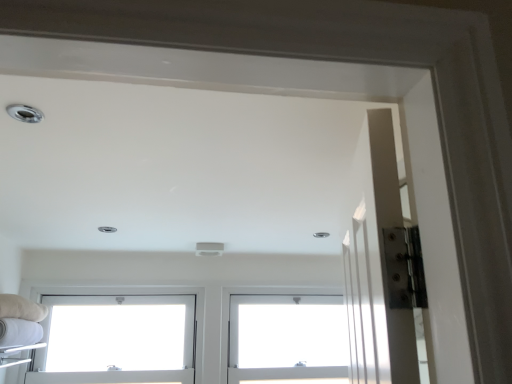
Find the location of a particular element. This screenshot has width=512, height=384. white plastic window at lower left, the 1th window from the left is located at coordinates (117, 340).

How much space does white plastic window at lower left, which appears as the second window when viewed from the right, occupy horizontally?

6.81 inches.

The image size is (512, 384). What do you see at coordinates (117, 340) in the screenshot?
I see `white plastic window at lower left, the 1th window from the left` at bounding box center [117, 340].

Measure the distance between white plastic window at center, which appears as the second window when viewed from the left, and camera.

white plastic window at center, which appears as the second window when viewed from the left, and camera are 6.82 feet apart from each other.

The width and height of the screenshot is (512, 384). Describe the element at coordinates (286, 338) in the screenshot. I see `white plastic window at center, which appears as the second window when viewed from the left` at that location.

Identify the location of white plastic window at center, the first window viewed from the right. Image resolution: width=512 pixels, height=384 pixels. (286, 338).

Locate an element on the screen. white plastic window at lower left, the 1th window from the left is located at coordinates (117, 340).

Between white plastic window at center, which appears as the second window when viewed from the left, and white plastic window at lower left, which appears as the second window when viewed from the right, which one appears on the right side from the viewer's perspective?

white plastic window at center, which appears as the second window when viewed from the left, is more to the right.

Is white plastic window at center, which appears as the second window when viewed from the left, in front of or behind white plastic window at lower left, the 1th window from the left, in the image?

Visually, white plastic window at center, which appears as the second window when viewed from the left, is located behind white plastic window at lower left, the 1th window from the left.

Between point (297, 311) and point (97, 334), which one is positioned behind?

Point (297, 311)

From the image's perspective, is white plastic window at center, the first window viewed from the right, above or below white plastic window at lower left, which appears as the second window when viewed from the right?

white plastic window at center, the first window viewed from the right, is situated lower than white plastic window at lower left, which appears as the second window when viewed from the right, in the image.

From a real-world perspective, relative to white plastic window at lower left, the 1th window from the left, is white plastic window at center, which appears as the second window when viewed from the left, vertically above or below?

From a real-world perspective, white plastic window at center, which appears as the second window when viewed from the left, is physically below white plastic window at lower left, the 1th window from the left.

Between white plastic window at center, which appears as the second window when viewed from the left, and white plastic window at lower left, the 1th window from the left, which one has larger width?

white plastic window at center, which appears as the second window when viewed from the left, is wider.

Considering the sizes of objects white plastic window at center, which appears as the second window when viewed from the left, and white plastic window at lower left, which appears as the second window when viewed from the right, in the image provided, who is taller, white plastic window at center, which appears as the second window when viewed from the left, or white plastic window at lower left, which appears as the second window when viewed from the right,?

With more height is white plastic window at center, which appears as the second window when viewed from the left.

In the scene shown: Considering the sizes of white plastic window at center, which appears as the second window when viewed from the left, and white plastic window at lower left, which appears as the second window when viewed from the right, in the image, is white plastic window at center, which appears as the second window when viewed from the left, bigger or smaller than white plastic window at lower left, which appears as the second window when viewed from the right,?

white plastic window at center, which appears as the second window when viewed from the left, is smaller than white plastic window at lower left, which appears as the second window when viewed from the right.

Do you think white plastic window at center, which appears as the second window when viewed from the left, is within white plastic window at lower left, which appears as the second window when viewed from the right, or outside of it?

white plastic window at center, which appears as the second window when viewed from the left, is outside white plastic window at lower left, which appears as the second window when viewed from the right.

Is white plastic window at center, which appears as the second window when viewed from the left, oriented towards white plastic window at lower left, which appears as the second window when viewed from the right?

No, white plastic window at center, which appears as the second window when viewed from the left, is not aimed at white plastic window at lower left, which appears as the second window when viewed from the right.

How many degrees apart are the facing directions of white plastic window at center, which appears as the second window when viewed from the left, and white plastic window at lower left, which appears as the second window when viewed from the right?

The facing directions of white plastic window at center, which appears as the second window when viewed from the left, and white plastic window at lower left, which appears as the second window when viewed from the right, are 0.000391 degrees apart.

Measure the distance between white plastic window at center, which appears as the second window when viewed from the left, and white plastic window at lower left, which appears as the second window when viewed from the right.

white plastic window at center, which appears as the second window when viewed from the left, and white plastic window at lower left, which appears as the second window when viewed from the right, are 23.92 inches apart from each other.

The height and width of the screenshot is (384, 512). I want to click on window located in front of the white plastic window at center, the first window viewed from the right, so click(117, 340).

Consider the image. Which object is positioned more to the right, white plastic window at lower left, which appears as the second window when viewed from the right, or white plastic window at center, the first window viewed from the right?

white plastic window at center, the first window viewed from the right, is more to the right.

Is white plastic window at lower left, which appears as the second window when viewed from the right, positioned in front of white plastic window at center, the first window viewed from the right?

Yes, the depth of white plastic window at lower left, which appears as the second window when viewed from the right, is less than that of white plastic window at center, the first window viewed from the right.

Is point (34, 369) closer to viewer compared to point (324, 370)?

Yes, it is in front of point (324, 370).

From the image's perspective, is white plastic window at lower left, the 1th window from the left, on white plastic window at center, which appears as the second window when viewed from the left?

Indeed, from the image's perspective, white plastic window at lower left, the 1th window from the left, is shown above white plastic window at center, which appears as the second window when viewed from the left.

Looking at this image, from a real-world perspective, does white plastic window at lower left, the 1th window from the left, stand above white plastic window at center, the first window viewed from the right?

Correct, in the physical world, white plastic window at lower left, the 1th window from the left, is higher than white plastic window at center, the first window viewed from the right.

Is white plastic window at lower left, which appears as the second window when viewed from the right, thinner than white plastic window at center, which appears as the second window when viewed from the left?

Correct, the width of white plastic window at lower left, which appears as the second window when viewed from the right, is less than that of white plastic window at center, which appears as the second window when viewed from the left.

From their relative heights in the image, would you say white plastic window at lower left, the 1th window from the left, is taller or shorter than white plastic window at center, the first window viewed from the right?

Clearly, white plastic window at lower left, the 1th window from the left, is shorter compared to white plastic window at center, the first window viewed from the right.

Can you confirm if white plastic window at lower left, the 1th window from the left, is smaller than white plastic window at center, which appears as the second window when viewed from the left?

No, white plastic window at lower left, the 1th window from the left, is not smaller than white plastic window at center, which appears as the second window when viewed from the left.

Is white plastic window at center, the first window viewed from the right, inside white plastic window at lower left, which appears as the second window when viewed from the right?

No, white plastic window at center, the first window viewed from the right, is not surrounded by white plastic window at lower left, which appears as the second window when viewed from the right.

Based on the photo, is white plastic window at lower left, the 1th window from the left, with white plastic window at center, which appears as the second window when viewed from the left?

No, white plastic window at lower left, the 1th window from the left, is not next to white plastic window at center, which appears as the second window when viewed from the left.

Is white plastic window at center, which appears as the second window when viewed from the left, at the back of white plastic window at lower left, the 1th window from the left?

No, white plastic window at center, which appears as the second window when viewed from the left, is not at the back of white plastic window at lower left, the 1th window from the left.

This screenshot has height=384, width=512. What are the coordinates of `window below the white plastic window at lower left, the 1th window from the left (from the image's perspective)` in the screenshot? It's located at (286, 338).

Find the location of a particular element. The height and width of the screenshot is (384, 512). window above the white plastic window at center, the first window viewed from the right (from the image's perspective) is located at coordinates (117, 340).

This screenshot has width=512, height=384. Identify the location of window on the right of white plastic window at lower left, which appears as the second window when viewed from the right. (286, 338).